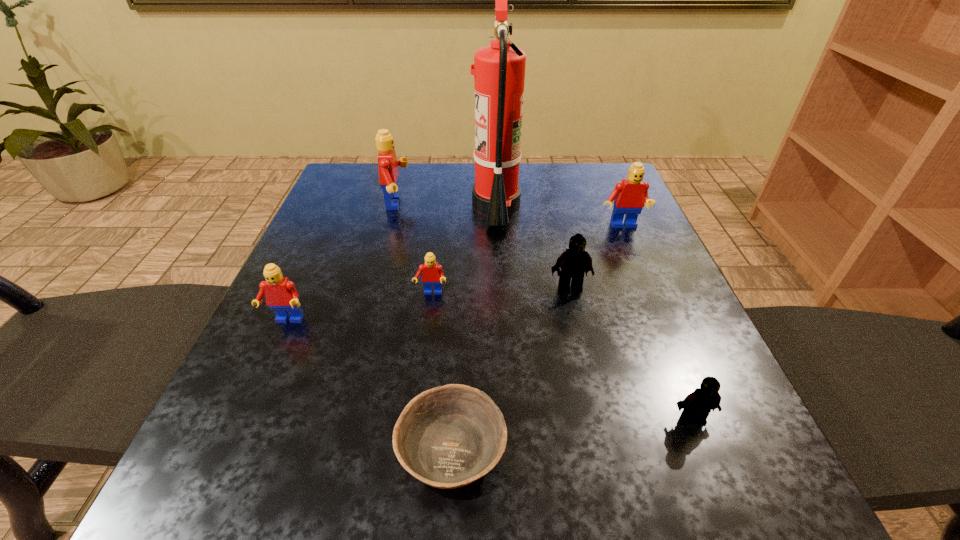
Where is `the nearer black Lego`? the nearer black Lego is located at coordinates (697, 405).

You are a GUI agent. You are given a task and a screenshot of the screen. Output one action in this format:
    pyautogui.click(x=<x>, y=<y>)
    Task: Click on the nearest Lego
    
    Given the screenshot: What is the action you would take?
    [697, 405]

Image resolution: width=960 pixels, height=540 pixels. What are the coordinates of `the second red Lego from right to left` in the screenshot? It's located at click(432, 275).

Where is `the second nearest red Lego`? The image size is (960, 540). the second nearest red Lego is located at coordinates (432, 275).

This screenshot has height=540, width=960. Identify the location of bowl. (447, 437).

Find the location of a particular element. The image size is (960, 540). free space located at the nozzle of the red fire extinguisher is located at coordinates (389, 206).

The height and width of the screenshot is (540, 960). Find the location of `vacant space located at the nozzle of the red fire extinguisher`. vacant space located at the nozzle of the red fire extinguisher is located at coordinates pyautogui.click(x=397, y=206).

Image resolution: width=960 pixels, height=540 pixels. Find the location of `free region located 0.200m at the nozzle of the red fire extinguisher`. free region located 0.200m at the nozzle of the red fire extinguisher is located at coordinates (389, 206).

Find the location of `vacant area located 0.160m on the front-facing side of the tallest Lego`. vacant area located 0.160m on the front-facing side of the tallest Lego is located at coordinates (475, 204).

Where is `free point located 0.200m on the front-facing side of the sixth shortest object`? free point located 0.200m on the front-facing side of the sixth shortest object is located at coordinates (650, 295).